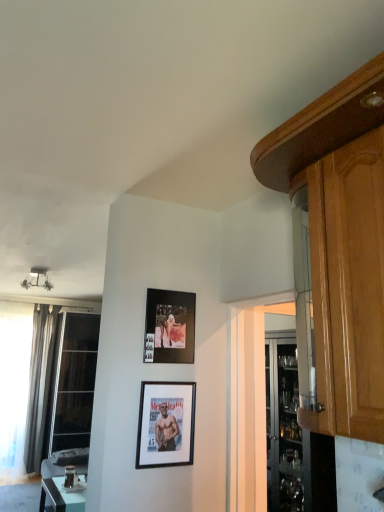
Question: Which direction should I rotate to face matte black photo frame at upper center, the 1th picture frame from the top, — up or down?

Choices:
 (A) down
 (B) up

Answer: (A)

Question: Would you say matte black photo frame at upper center, the 1th picture frame from the top, is a long distance from transparent glass window at left, which ranks as the 2th window in left-to-right order?

Choices:
 (A) no
 (B) yes

Answer: (B)

Question: Is matte black photo frame at upper center, positioned as the 2th picture frame in bottom-to-top order, next to transparent glass window at left, the 1th window from the right, and touching it?

Choices:
 (A) yes
 (B) no

Answer: (B)

Question: Does matte black photo frame at upper center, the 1th picture frame from the top, lie behind transparent glass window at left, which ranks as the 2th window in left-to-right order?

Choices:
 (A) no
 (B) yes

Answer: (A)

Question: Considering the relative sizes of matte black photo frame at upper center, the 1th picture frame from the top, and transparent glass window at left, the 1th window from the right, in the image provided, is matte black photo frame at upper center, the 1th picture frame from the top, shorter than transparent glass window at left, the 1th window from the right,?

Choices:
 (A) no
 (B) yes

Answer: (B)

Question: From a real-world perspective, does matte black photo frame at upper center, the 1th picture frame from the top, stand above transparent glass window at left, which ranks as the 2th window in left-to-right order?

Choices:
 (A) yes
 (B) no

Answer: (A)

Question: Is transparent glass window at left, which ranks as the 2th window in left-to-right order, located within matte black photo frame at upper center, the 1th picture frame from the top?

Choices:
 (A) no
 (B) yes

Answer: (A)

Question: From a real-world perspective, is glossy wood cabinet at upper right under silky gray curtain at left?

Choices:
 (A) no
 (B) yes

Answer: (A)

Question: Are glossy wood cabinet at upper right and silky gray curtain at left located far from each other?

Choices:
 (A) yes
 (B) no

Answer: (A)

Question: Is glossy wood cabinet at upper right at the right side of silky gray curtain at left?

Choices:
 (A) yes
 (B) no

Answer: (A)

Question: Does glossy wood cabinet at upper right have a larger size compared to silky gray curtain at left?

Choices:
 (A) yes
 (B) no

Answer: (A)

Question: Is glossy wood cabinet at upper right oriented towards silky gray curtain at left?

Choices:
 (A) no
 (B) yes

Answer: (A)

Question: Would you say silky gray curtain at left is part of glossy wood cabinet at upper right's contents?

Choices:
 (A) yes
 (B) no

Answer: (B)

Question: Can you confirm if silky gray curtain at left is wider than black matte picture frame at center, which ranks as the 1th picture frame in bottom-to-top order?

Choices:
 (A) yes
 (B) no

Answer: (A)